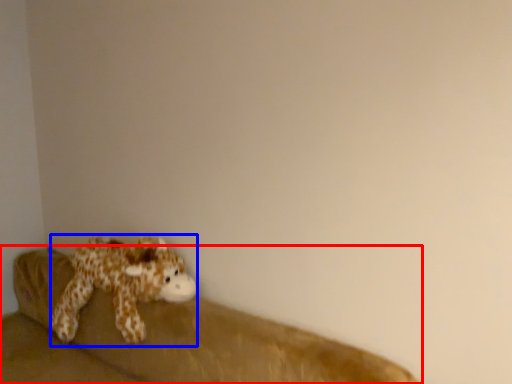
Question: Which point is further to the camera, studio couch (highlighted by a red box) or toy (highlighted by a blue box)?

Choices:
 (A) studio couch
 (B) toy

Answer: (B)